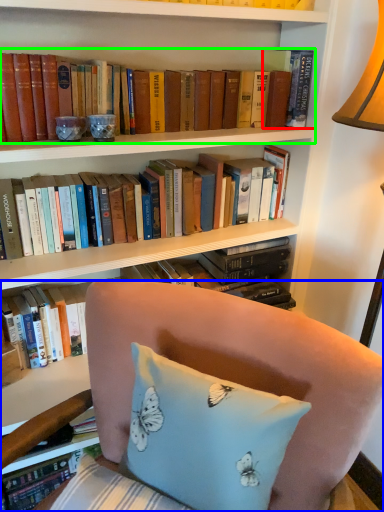
Question: Which is nearer to the book (highlighted by a red box)? chair (highlighted by a blue box) or book (highlighted by a green box).

Choices:
 (A) chair
 (B) book

Answer: (B)